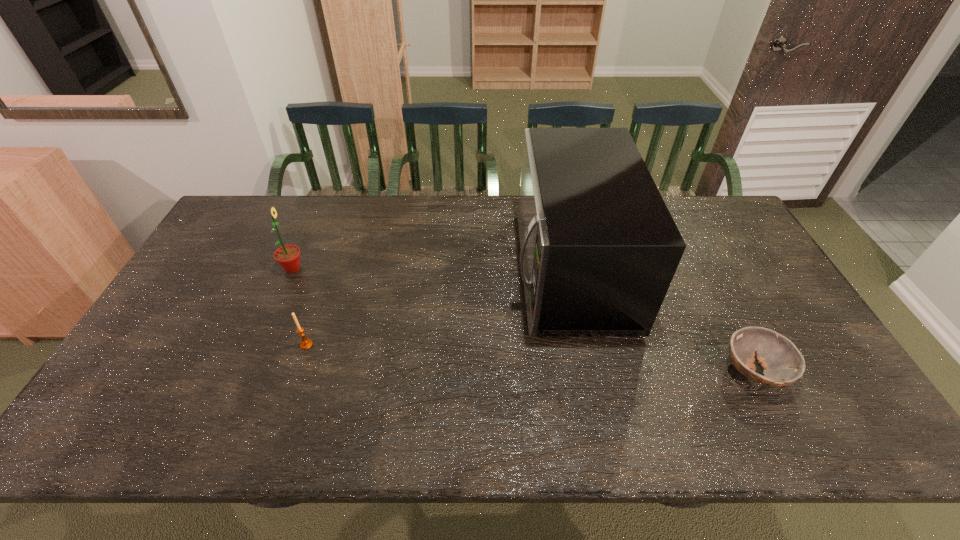
Find the location of a particular element. This screenshot has height=540, width=960. vacant space located 0.310m with the door open on the third object from left to right is located at coordinates (413, 269).

At what (x,y) coordinates should I click in order to perform the action: click on blank space located on the face of the sunflower. Please return your answer as a coordinate pair (x, y). The width and height of the screenshot is (960, 540). Looking at the image, I should click on (427, 268).

The width and height of the screenshot is (960, 540). What are the coordinates of `vacant space located on the back of the candle_holder` in the screenshot? It's located at (340, 246).

The height and width of the screenshot is (540, 960). In order to click on blank space located on the back of the shortest object in this screenshot , I will do `click(717, 300)`.

The image size is (960, 540). I want to click on object situated at the far edge, so click(x=599, y=248).

This screenshot has width=960, height=540. I want to click on object that is at the right edge, so click(783, 364).

In the image, there is a desktop. Where is `vacant space at the far edge`? This screenshot has width=960, height=540. vacant space at the far edge is located at coordinates (319, 198).

The image size is (960, 540). In the image, there is a desktop. Identify the location of free region at the near edge. (784, 410).

Where is `free space at the left edge`? This screenshot has height=540, width=960. free space at the left edge is located at coordinates (201, 319).

Locate an element on the screen. This screenshot has width=960, height=540. free space at the right edge is located at coordinates (814, 360).